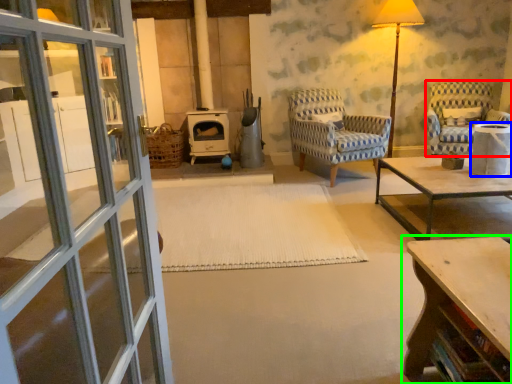
Question: Estimate the real-world distances between objects in this image. Which object is closer to chair (highlighted by a red box), side table (highlighted by a blue box) or table (highlighted by a green box)?

Choices:
 (A) side table
 (B) table

Answer: (A)